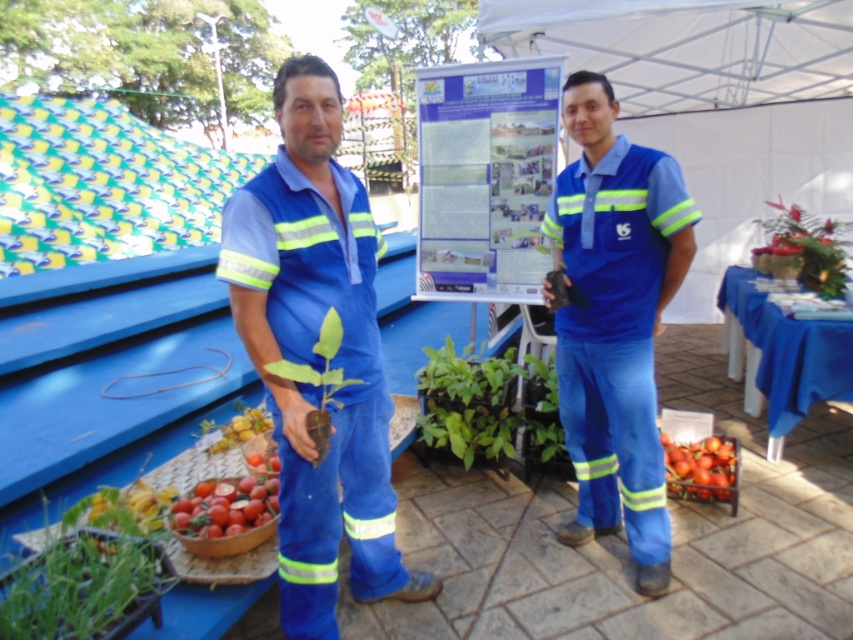
How distant is green leafy plant at lower left from smooth red tomato at lower left?

3.65 feet

The width and height of the screenshot is (853, 640). What do you see at coordinates (84, 588) in the screenshot?
I see `green leafy plant at lower left` at bounding box center [84, 588].

What are the coordinates of `green leafy plant at lower left` in the screenshot? It's located at (84, 588).

Locate an element on the screen. The width and height of the screenshot is (853, 640). green leafy plant at lower left is located at coordinates (84, 588).

Looking at this image, is blue fabric shirt at center thinner than green leafy plant at lower left?

Correct, blue fabric shirt at center's width is less than green leafy plant at lower left's.

Is point (572, 385) less distant than point (108, 536)?

No, (572, 385) is behind (108, 536).

The image size is (853, 640). I want to click on blue fabric shirt at center, so click(614, 332).

Is smooth glossy tomatoes at center positioned before smooth red tomato at lower left?

Yes, smooth glossy tomatoes at center is in front of smooth red tomato at lower left.

Which is behind, point (717, 477) or point (259, 410)?

Positioned behind is point (259, 410).

Is point (671, 442) positioned in front of point (221, 433)?

No, (671, 442) is behind (221, 433).

Where is `smooth glossy tomatoes at center`? The width and height of the screenshot is (853, 640). smooth glossy tomatoes at center is located at coordinates (701, 467).